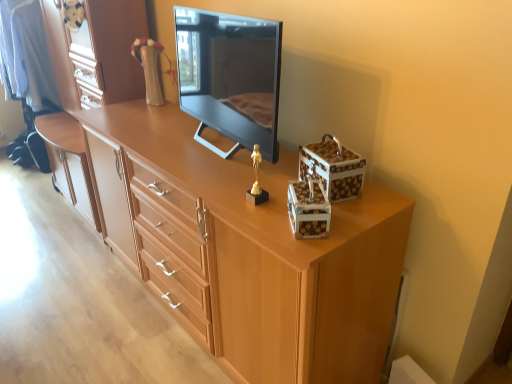
At what (x,y) coordinates should I click in order to perform the action: click on free spot behind gold metallic statue at center. Please return your answer as a coordinate pair (x, y). Looking at the image, I should click on (248, 177).